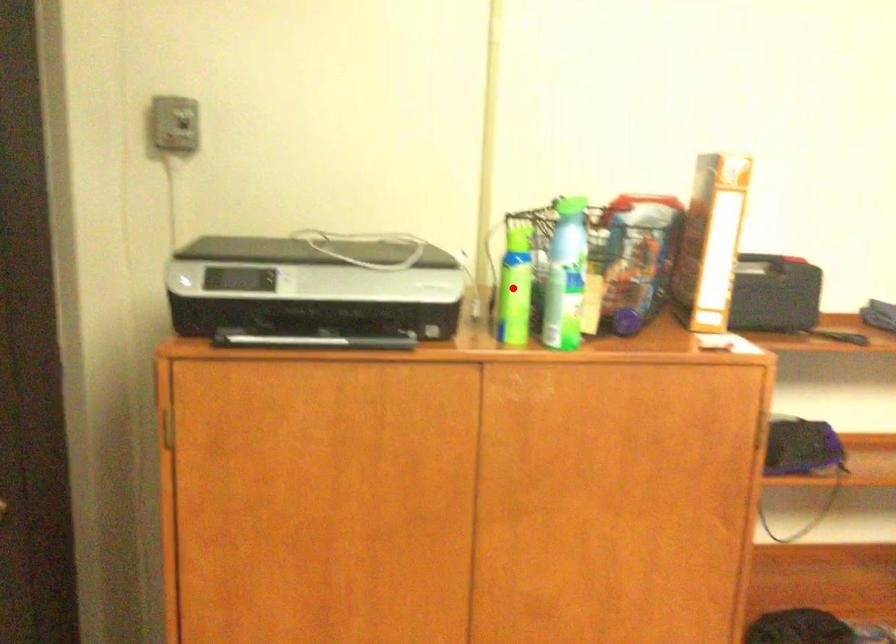
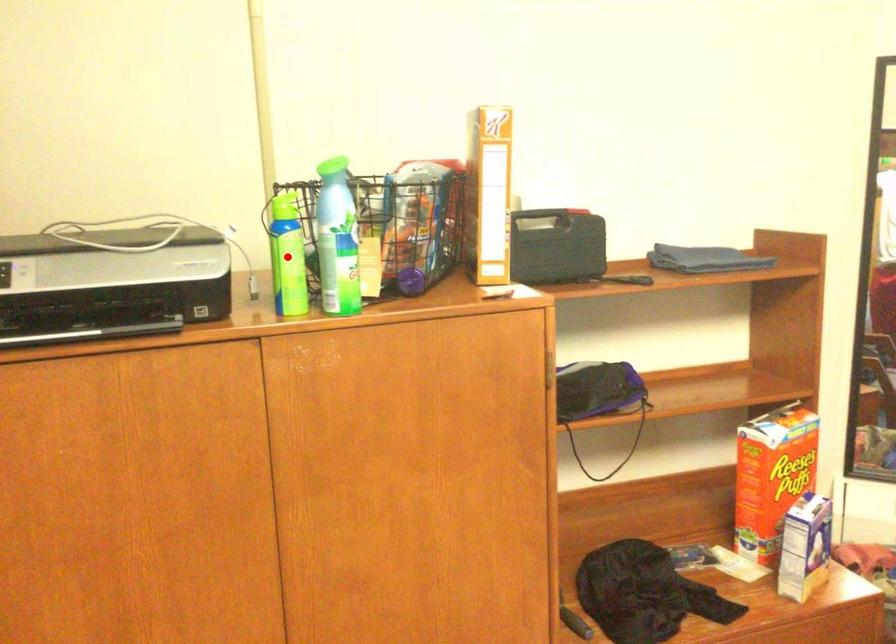
I am providing you with two images of the same scene from different viewpoints. A red point is marked on the first image and another point is marked on the second image. Does the point marked in image1 correspond to the same location as the one in image2?

Yes